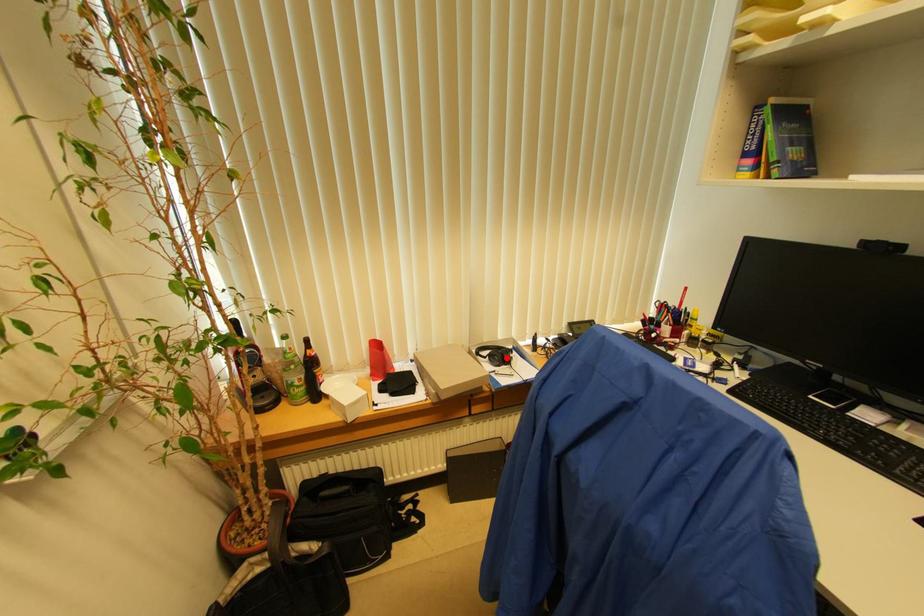
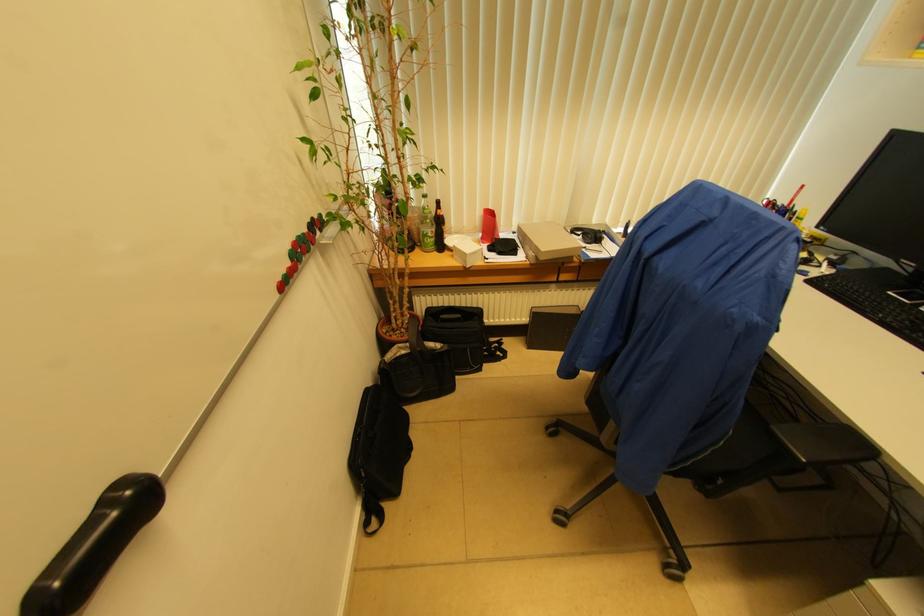
Where in the second image is the point corresponding to the highlighted location from the first image?

(599, 237)